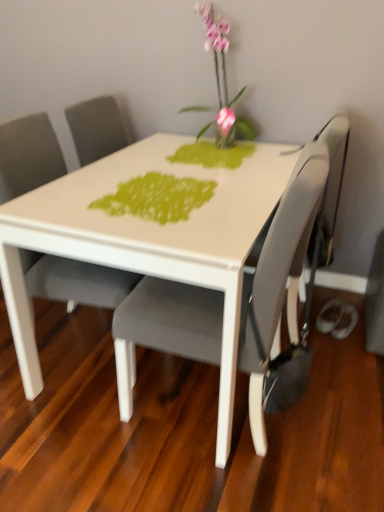
Where is `spots to the right of matte gray chair at center, acting as the first chair starting from the right`? The width and height of the screenshot is (384, 512). spots to the right of matte gray chair at center, acting as the first chair starting from the right is located at coordinates (338, 408).